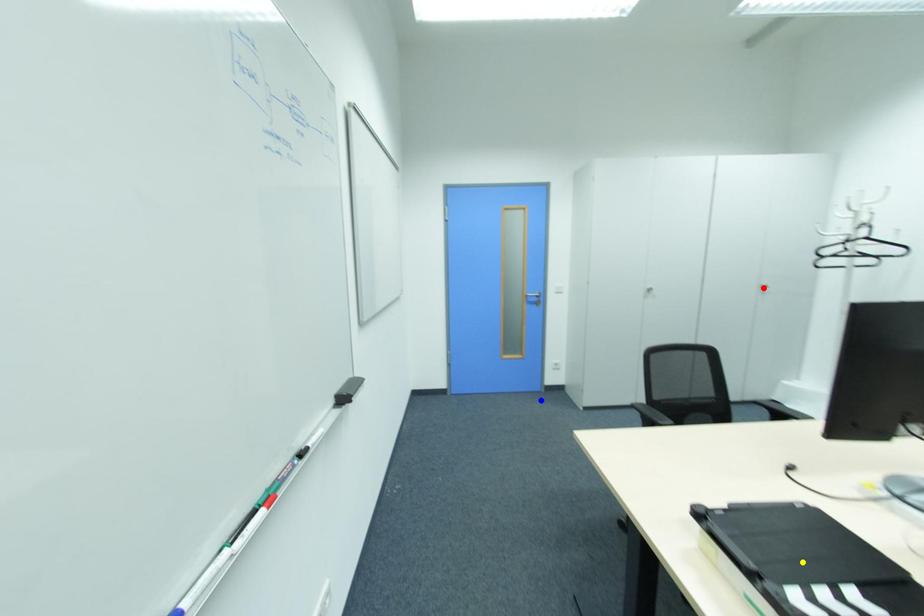
Order these from nearest to farthest:
1. yellow point
2. red point
3. blue point

yellow point, blue point, red point